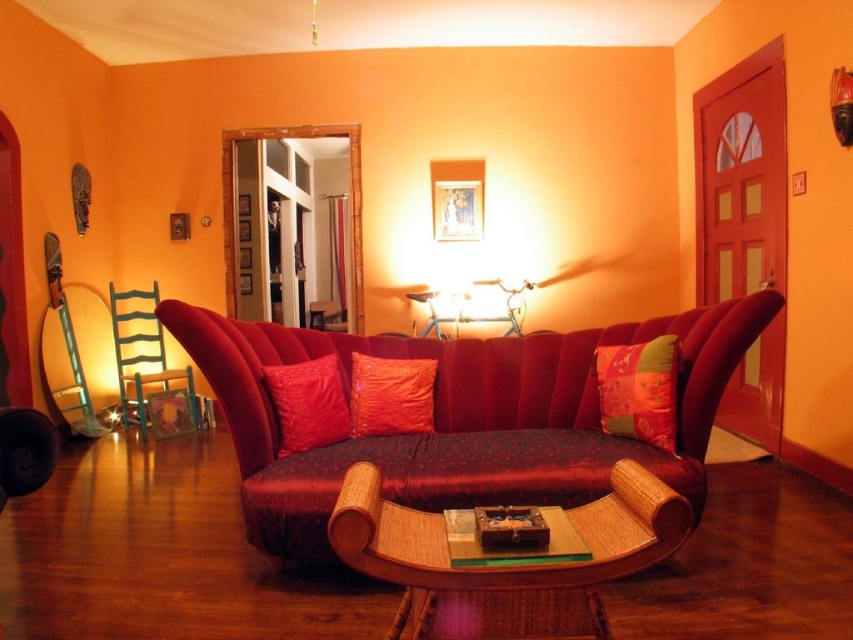
Question: In this image, where is velvet red couch at center located relative to green painted wood armchair at left?

Choices:
 (A) left
 (B) right

Answer: (B)

Question: Which object is closer to the camera taking this photo?

Choices:
 (A) velvet cushion at center
 (B) shiny red pillow at center
 (C) wooden chest at center

Answer: (C)

Question: Can you confirm if velvet red couch at center is positioned to the left of silky red pillow at center?

Choices:
 (A) yes
 (B) no

Answer: (A)

Question: Which object is farther from the camera taking this photo?

Choices:
 (A) woven bamboo coffee table at center
 (B) wooden chest at center
 (C) velvet red couch at center

Answer: (C)

Question: Based on their relative distances, which object is nearer to the velvet cushion at center?

Choices:
 (A) woven bamboo coffee table at center
 (B) silky red pillow at center

Answer: (A)

Question: Where is velvet red couch at center located in relation to green painted wood armchair at left in the image?

Choices:
 (A) left
 (B) right

Answer: (B)